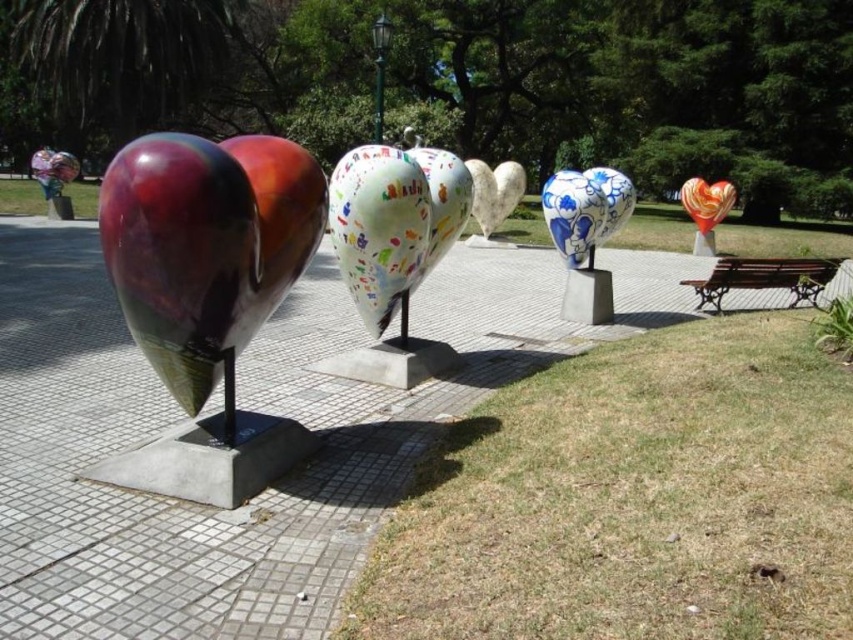
Is glossy metallic heart at left behind multicolored glossy heart at upper right?

Yes.

Is glossy metallic heart at left smaller than multicolored glossy heart at upper right?

Correct, glossy metallic heart at left occupies less space than multicolored glossy heart at upper right.

Where is `glossy metallic heart at left`? Image resolution: width=853 pixels, height=640 pixels. glossy metallic heart at left is located at coordinates (54, 179).

Is porcelain heart at center wider than white marble heart at center?

In fact, porcelain heart at center might be narrower than white marble heart at center.

Between porcelain heart at center and white marble heart at center, which one has more height?

white marble heart at center

You are a GUI agent. You are given a task and a screenshot of the screen. Output one action in this format:
    pyautogui.click(x=<x>, y=<y>)
    Task: Click on the porcelain heart at center
    The image size is (853, 640).
    Given the screenshot: What is the action you would take?
    pyautogui.click(x=585, y=234)

Between white glossy heart at center and brown wrought iron bench at lower right, which one appears on the right side from the viewer's perspective?

From the viewer's perspective, brown wrought iron bench at lower right appears more on the right side.

Is white glossy heart at center to the left of brown wrought iron bench at lower right from the viewer's perspective?

Yes, white glossy heart at center is to the left of brown wrought iron bench at lower right.

Does point (395, 285) come closer to viewer compared to point (746, 276)?

Yes, it is.

Where is `white glossy heart at center`? The height and width of the screenshot is (640, 853). white glossy heart at center is located at coordinates (378, 227).